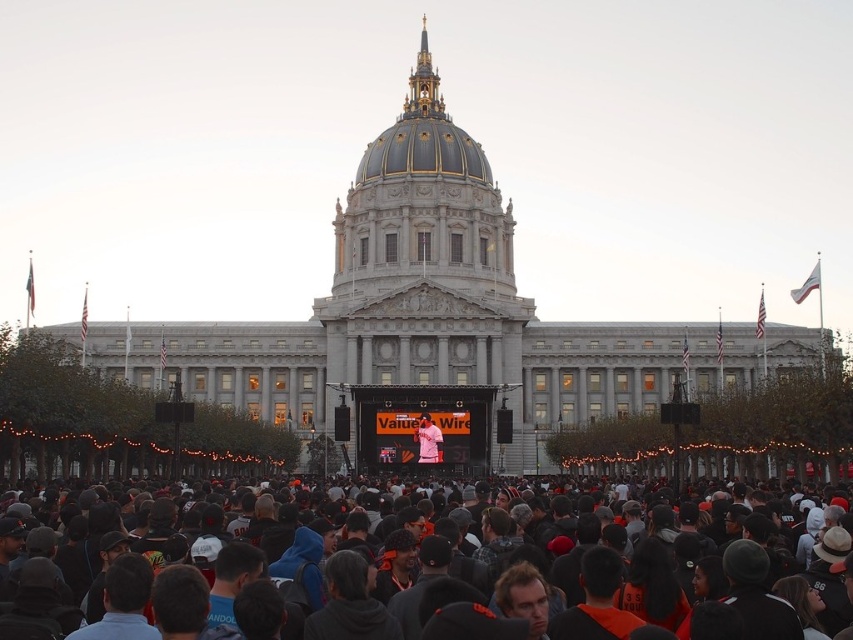
Can you confirm if black fabric crowd at center is positioned to the left of matte pink shirt at center?

Yes, black fabric crowd at center is to the left of matte pink shirt at center.

Can you confirm if black fabric crowd at center is smaller than matte pink shirt at center?

No, black fabric crowd at center is not smaller than matte pink shirt at center.

Which is behind, point (842, 609) or point (427, 454)?

The point (427, 454) is more distant.

Where is `black fabric crowd at center`? This screenshot has height=640, width=853. black fabric crowd at center is located at coordinates (831, 589).

Which is behind, point (483, 170) or point (428, 456)?

The point (483, 170) is behind.

Does gold-plated dome at center have a greater width compared to matte pink shirt at center?

Correct, the width of gold-plated dome at center exceeds that of matte pink shirt at center.

Does point (460, 147) come farther from viewer compared to point (428, 419)?

Yes, point (460, 147) is farther from viewer.

Locate an element on the screen. gold-plated dome at center is located at coordinates (422, 134).

Which is below, black fabric crowd at center or gold-plated dome at center?

black fabric crowd at center is below.

Is black fabric crowd at center shorter than gold-plated dome at center?

Yes, black fabric crowd at center is shorter than gold-plated dome at center.

Describe the element at coordinates (831, 589) in the screenshot. The height and width of the screenshot is (640, 853). I see `black fabric crowd at center` at that location.

The image size is (853, 640). What are the coordinates of `black fabric crowd at center` in the screenshot? It's located at (831, 589).